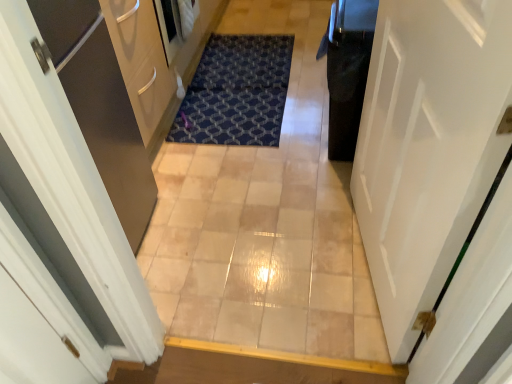
Find the location of `vacant area that lies between white glossy door at right and black glossy trash can at right`. vacant area that lies between white glossy door at right and black glossy trash can at right is located at coordinates (336, 213).